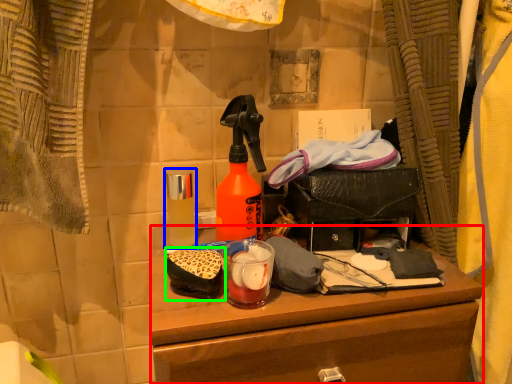
Question: Considering the real-world distances, which object is farthest from desk (highlighted by a red box)? bottle (highlighted by a blue box) or debris (highlighted by a green box)?

Choices:
 (A) bottle
 (B) debris

Answer: (A)